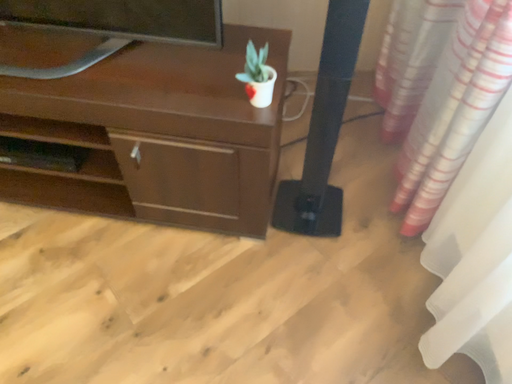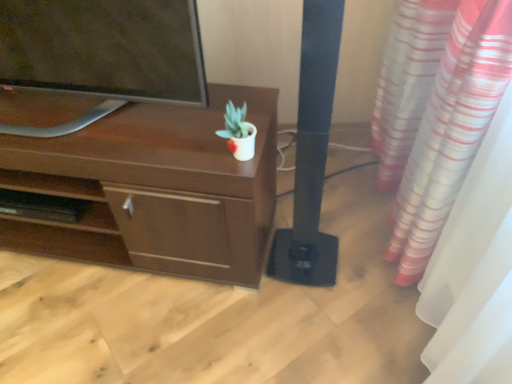
Question: How did the camera likely rotate when shooting the video?

Choices:
 (A) rotated upward
 (B) rotated downward

Answer: (A)